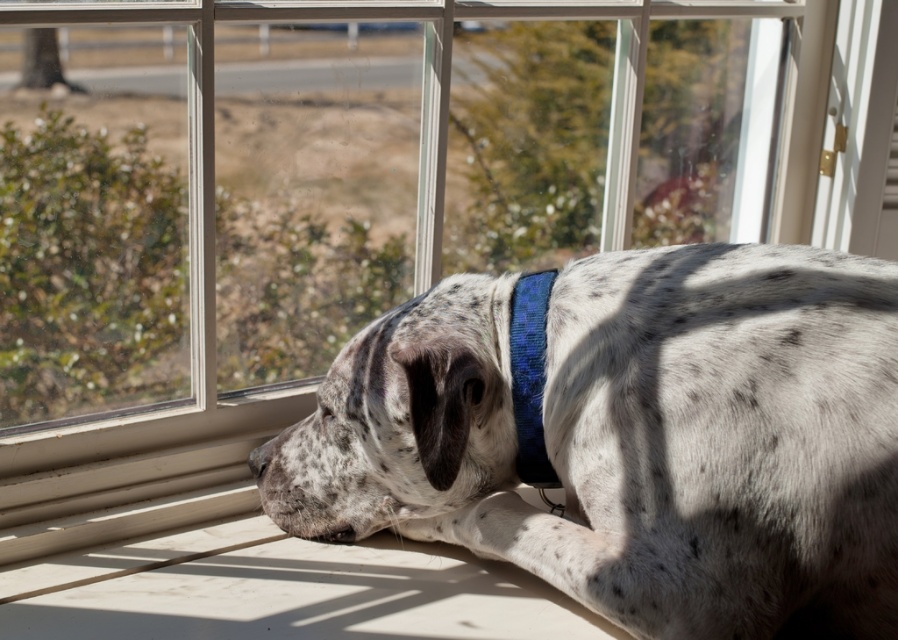
Is point (467, 513) closer to viewer compared to point (518, 289)?

No, it is behind (518, 289).

Which is below, speckled fur at lower center or blue textured fabric neckband at center?

speckled fur at lower center

Find the location of a particular element. The image size is (898, 640). speckled fur at lower center is located at coordinates (634, 438).